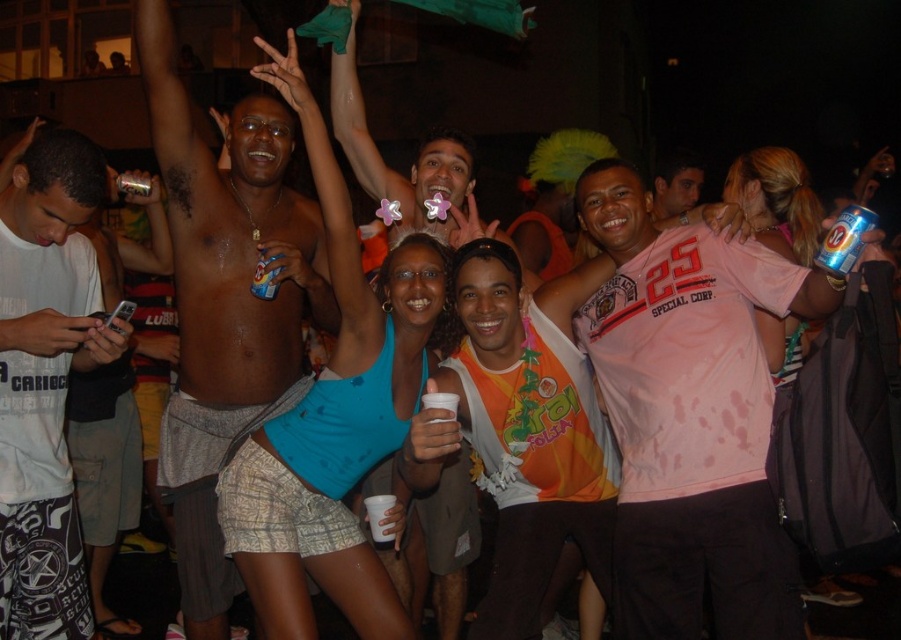
Question: Is blue fabric tank top at center closer to the viewer compared to white printed t-shirt at left?

Choices:
 (A) no
 (B) yes

Answer: (A)

Question: Among these objects, which one is nearest to the camera?

Choices:
 (A) pink jersey at center
 (B) white printed t-shirt at left

Answer: (A)

Question: Considering the real-world distances, which object is farthest from the blue fabric tank top at center?

Choices:
 (A) matte blue tank top at center
 (B) matte pink shirt at center
 (C) shiny metallic shorts at center

Answer: (B)

Question: Which of these objects is positioned farthest from the blue fabric tank top at center?

Choices:
 (A) matte blue tank top at center
 (B) white printed t-shirt at left
 (C) matte pink shirt at center

Answer: (C)

Question: Is blue fabric tank top at center bigger than white printed t-shirt at left?

Choices:
 (A) no
 (B) yes

Answer: (B)

Question: Does pink jersey at center come in front of shiny metallic shorts at center?

Choices:
 (A) no
 (B) yes

Answer: (B)